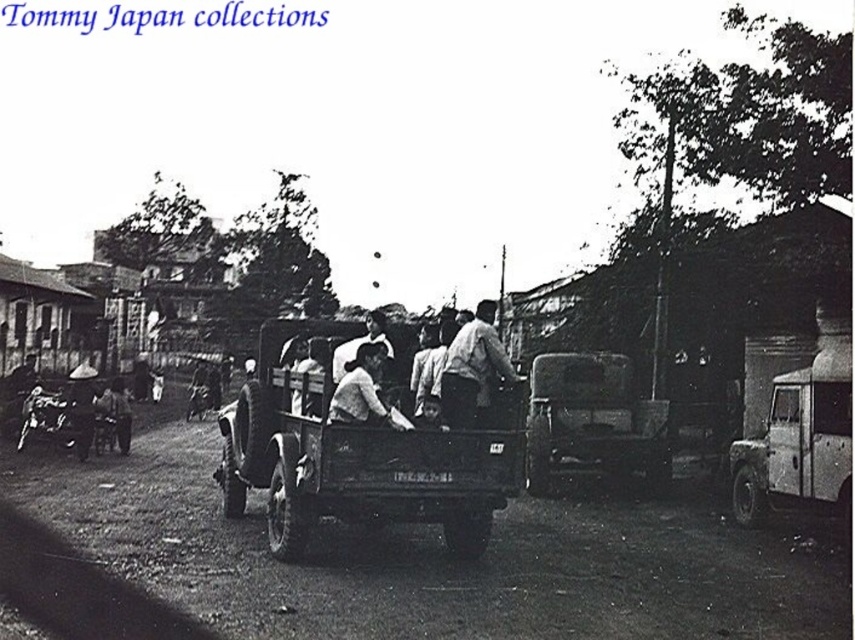
You are a photographer analyzing this historical image. You notice the smooth white shirt at center and the smooth skin man at center. Which object has a greater width in the image?

The smooth white shirt at center has a greater width than the smooth skin man at center according to the description.

You are a photographer analyzing this black and white photo. You notice a smooth white shirt at center. Can you determine its position relative to the center of the image using coordinates?

The smooth white shirt at center is located at point (363, 390), which means it is slightly to the right and above the exact center of the image.

You are standing on the side of the road in the image and want to approach the metallic silver pickup truck at center and the smooth skin man at center. Which one will you reach first?

You will reach the metallic silver pickup truck at center first because it is closer to you than the smooth skin man at center.